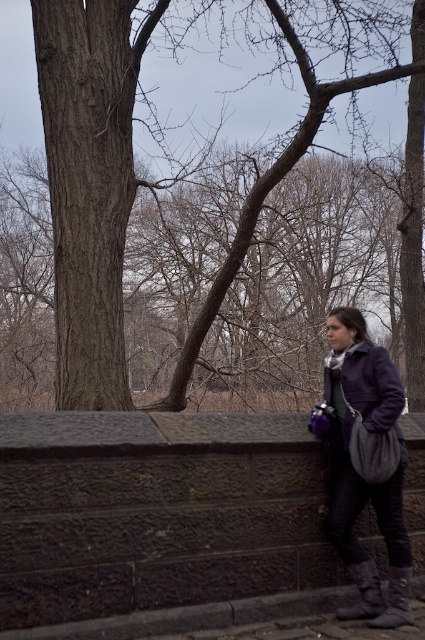
Question: Considering the relative positions of dark stone wall at lower center and matte purple coat at right in the image provided, where is dark stone wall at lower center located with respect to matte purple coat at right?

Choices:
 (A) left
 (B) right

Answer: (A)

Question: Does matte purple coat at right come behind matte purple coat at center?

Choices:
 (A) yes
 (B) no

Answer: (B)

Question: Is brown textured bark at left positioned behind matte purple coat at right?

Choices:
 (A) no
 (B) yes

Answer: (B)

Question: Which object is the farthest from the matte purple coat at center?

Choices:
 (A) dark stone wall at lower center
 (B) matte purple coat at right

Answer: (A)

Question: Which point is farther to the camera?

Choices:
 (A) matte purple coat at center
 (B) brown textured bark at left
 (C) dark stone wall at lower center

Answer: (B)

Question: Which of the following is the farthest from the observer?

Choices:
 (A) (263, 525)
 (B) (192, 342)
 (C) (377, 372)

Answer: (B)